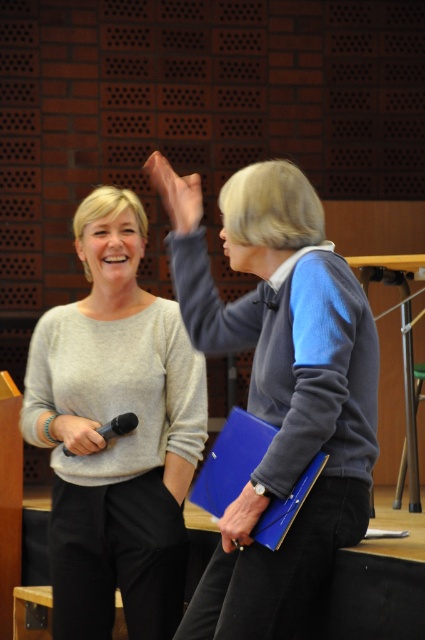
You are a photographer trying to capture a clear shot of both the blue corduroy sweater at center and the matte gray sweater at center. Which sweater should you focus on first to ensure both are in focus?

You should focus on the blue corduroy sweater at center first since it is closer to the viewer. By focusing on the closer object, the matte gray sweater at center, which is farther away, will also be in focus due to the depth of field.

You are organizing a charity event and need to decide which of the two sweaters, the blue corduroy sweater at center or the matte gray sweater at center, can accommodate a larger embroidered logo. Based on the image, which sweater would you choose?

The blue corduroy sweater at center is larger in size than the matte gray sweater at center, so it can accommodate a larger embroidered logo.